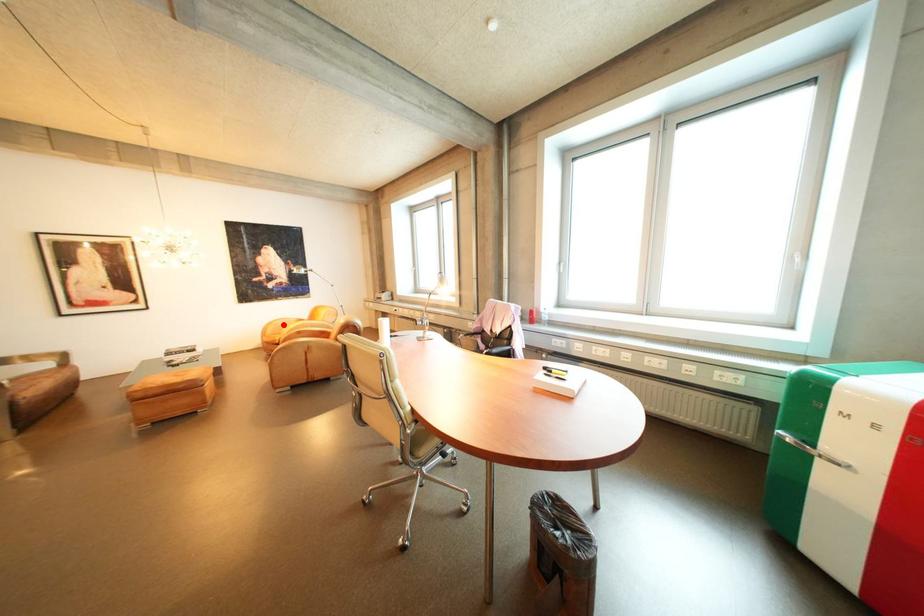
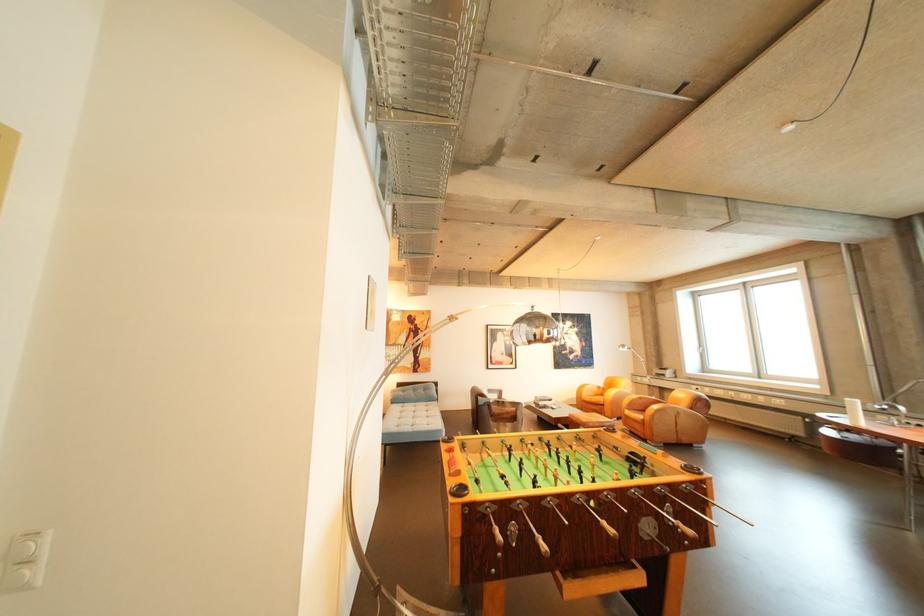
Find the pixel in the second image that matches the highlighted location in the first image.

(594, 387)